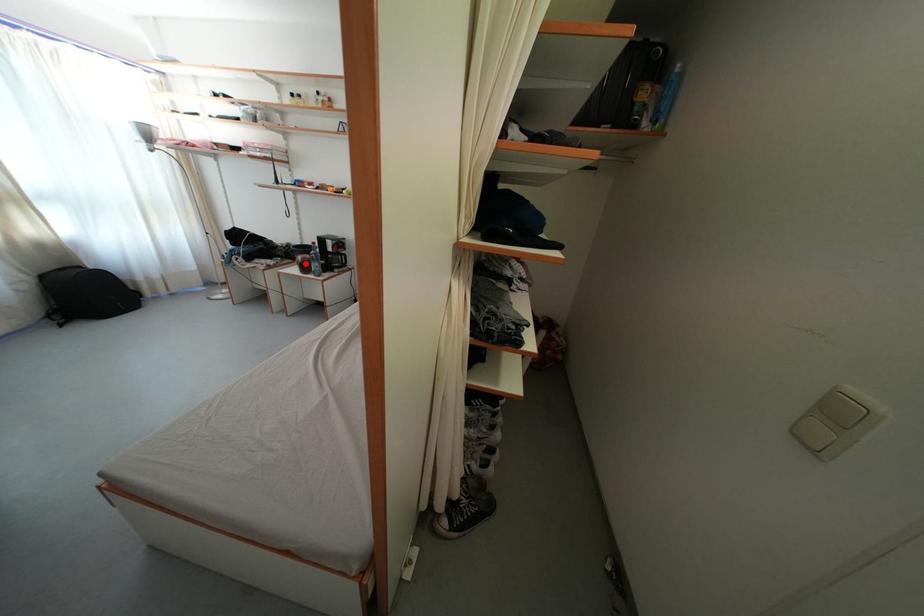
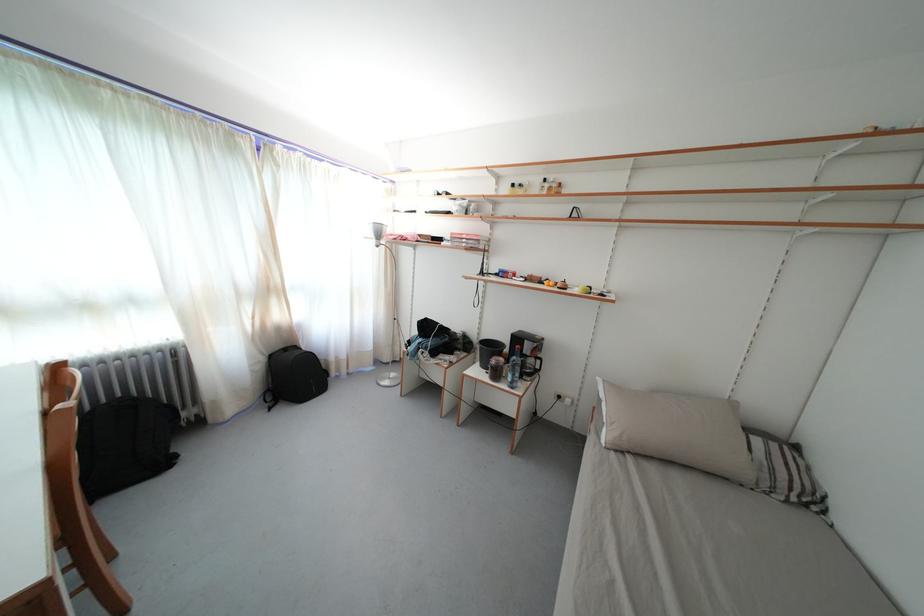
Where in the second image is the point corresponding to the highlighted location from the first image?

(499, 367)